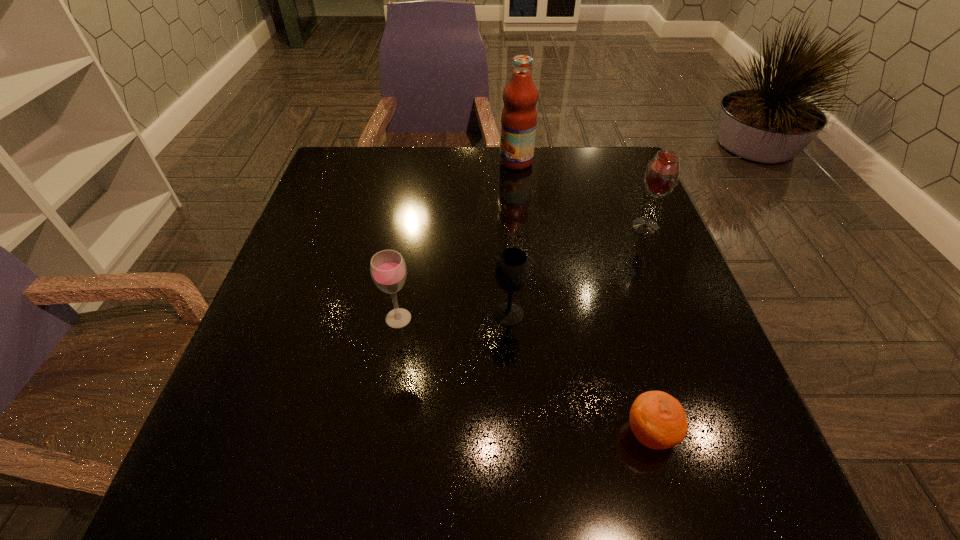
At what (x,y) coordinates should I click in order to perform the action: click on empty location between the tallest object and the leftmost object. Please return your answer as a coordinate pair (x, y). Image resolution: width=960 pixels, height=540 pixels. Looking at the image, I should click on (457, 240).

Locate an element on the screen. unoccupied area between the leftmost object and the fruit juice is located at coordinates (457, 240).

Identify the location of vacant space that is in between the second wineglass from right to left and the farthest object. Image resolution: width=960 pixels, height=540 pixels. (513, 238).

This screenshot has height=540, width=960. Find the location of `vacant area between the second wineglass from right to left and the leftmost wineglass`. vacant area between the second wineglass from right to left and the leftmost wineglass is located at coordinates (453, 316).

Identify the location of empty space between the farthest object and the second wineglass from right to left. The height and width of the screenshot is (540, 960). (513, 238).

Locate which object is the closest to the nearest object. Please provide its 2D coordinates. Your answer should be formatted as a tuple, i.e. [(x, y)], where the tuple contains the x and y coordinates of a point satisfying the conditions above.

[(511, 269)]

The height and width of the screenshot is (540, 960). Find the location of `the fourth closest object to the leftmost object`. the fourth closest object to the leftmost object is located at coordinates pyautogui.click(x=662, y=174).

Identify the location of wineglass that is the closest one to the farthest wineglass. pyautogui.click(x=511, y=269).

Select which wineglass appears as the second closest to the tallest object. Please provide its 2D coordinates. Your answer should be formatted as a tuple, i.e. [(x, y)], where the tuple contains the x and y coordinates of a point satisfying the conditions above.

[(511, 269)]

Locate an element on the screen. Image resolution: width=960 pixels, height=540 pixels. vacant region that satisfies the following two spatial constraints: 1. on the front label of the tallest object; 2. on the front side of the leftmost wineglass is located at coordinates (533, 318).